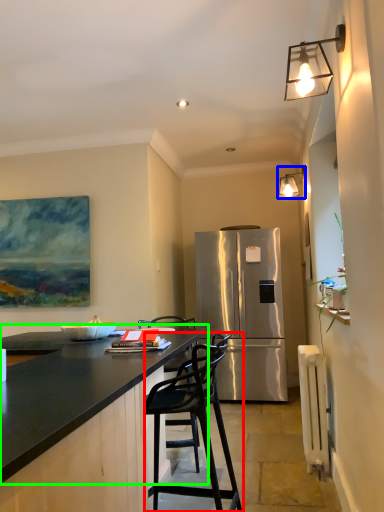
Question: Which object is the closest to the chair (highlighted by a red box)? Choose among these: lamp (highlighted by a blue box) or countertop (highlighted by a green box).

Choices:
 (A) lamp
 (B) countertop

Answer: (B)